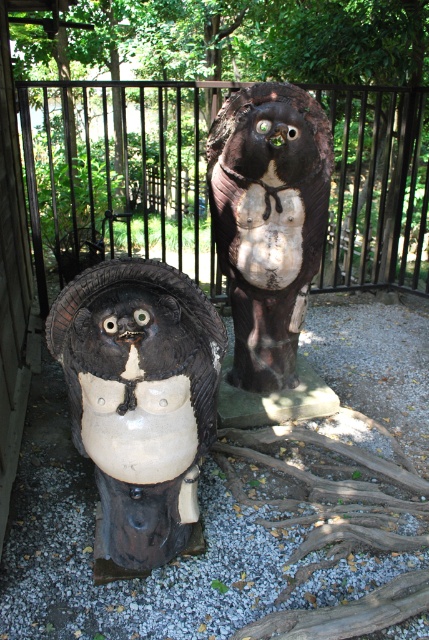
You are standing in front of the two statues and want to take a photo of the point at coordinate point (102,384). If your camera can focus on objects within 5 feet, will you need to step back to get it in focus?

The distance of point (102,384) from the camera is 6.42 feet, which is beyond the camera focus range of 5 feet. Therefore, you need to step back to get it in focus.

You are standing in front of the two statues and notice a wooden owl at center. Based on its position, can you determine if the owl is closer to the left statue or the right statue?

The wooden owl at center is located at point (139, 397). Since the coordinates are closer to the right side of the image, the owl is closer to the right statue.